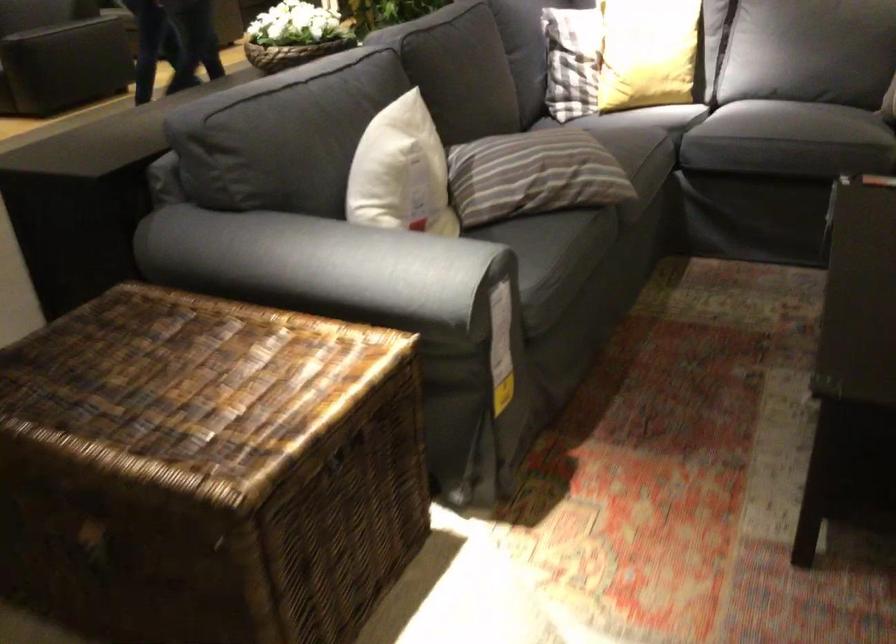
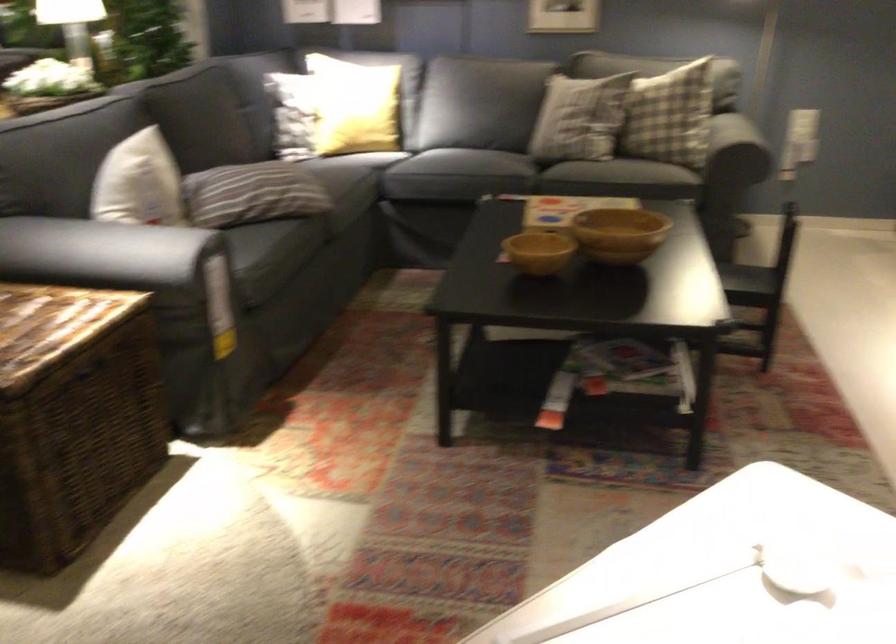
The point at (293, 370) is marked in the first image. Where is the corresponding point in the second image?

(55, 317)